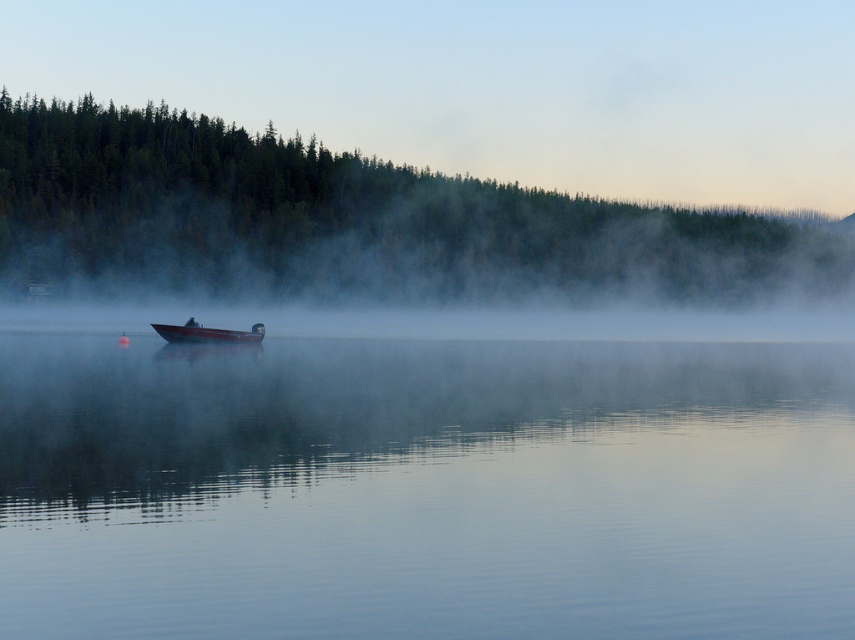
Does clear water at center have a larger size compared to metallic red boat at center?

Yes.

Does clear water at center have a lesser height compared to metallic red boat at center?

No, clear water at center is not shorter than metallic red boat at center.

Locate an element on the screen. Image resolution: width=855 pixels, height=640 pixels. clear water at center is located at coordinates tap(423, 488).

This screenshot has height=640, width=855. Identify the location of clear water at center. (423, 488).